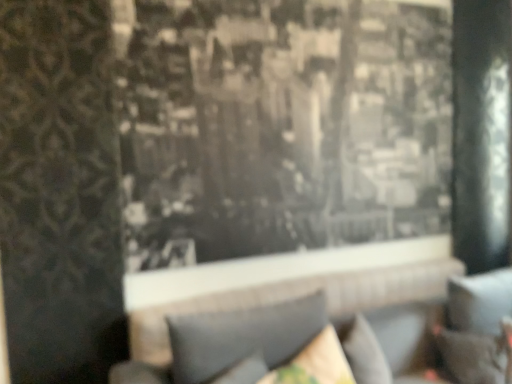
You are a GUI agent. You are given a task and a screenshot of the screen. Output one action in this format:
    pyautogui.click(x=<x>, y=<y>)
    Task: Click on the velvet beige pillow at lower center, the second pillow in the right-to-left sequence
    The height and width of the screenshot is (384, 512).
    Given the screenshot: What is the action you would take?
    pyautogui.click(x=315, y=363)

In order to face textured gray pillow at lower center, which is the 1th pillow from left to right, should I rotate leftwards or rightwards?

Turn right by 0.058 degrees to look at textured gray pillow at lower center, which is the 1th pillow from left to right.

The width and height of the screenshot is (512, 384). I want to click on gray fabric couch at center, so click(234, 338).

Is velvet beige pillow at lower center, arranged as the 2th pillow when viewed from the left, oriented towards textured gray pillow at lower center, placed as the 3th pillow when sorted from right to left?

Yes.

Are velvet beige pillow at lower center, the second pillow in the right-to-left sequence, and textured gray pillow at lower center, placed as the 3th pillow when sorted from right to left, beside each other?

No, velvet beige pillow at lower center, the second pillow in the right-to-left sequence, is not touching textured gray pillow at lower center, placed as the 3th pillow when sorted from right to left.

What's the angular difference between velvet beige pillow at lower center, arranged as the 2th pillow when viewed from the left, and textured gray pillow at lower center, which is the 1th pillow from left to right,'s facing directions?

There is a 0.000548-degree angle between the facing directions of velvet beige pillow at lower center, arranged as the 2th pillow when viewed from the left, and textured gray pillow at lower center, which is the 1th pillow from left to right.

Who is taller, velvet beige pillow at lower center, the second pillow in the right-to-left sequence, or black textured fabric at center?

black textured fabric at center is taller.

Is velvet beige pillow at lower center, arranged as the 2th pillow when viewed from the left, facing away from black textured fabric at center?

velvet beige pillow at lower center, arranged as the 2th pillow when viewed from the left, is not turned away from black textured fabric at center.

Is velvet beige pillow at lower center, arranged as the 2th pillow when viewed from the left, positioned behind black textured fabric at center?

No, it is in front of black textured fabric at center.

From a real-world perspective, is velvet beige pillow at lower center, arranged as the 2th pillow when viewed from the left, positioned above or below black textured fabric at center?

From a real-world perspective, velvet beige pillow at lower center, arranged as the 2th pillow when viewed from the left, is physically below black textured fabric at center.

How much distance is there between textured gray pillow at lower center, which is the 1th pillow from left to right, and black textured fabric at center?

textured gray pillow at lower center, which is the 1th pillow from left to right, is 33.33 inches away from black textured fabric at center.

Is textured gray pillow at lower center, which is the 1th pillow from left to right, positioned with its back to black textured fabric at center?

No, textured gray pillow at lower center, which is the 1th pillow from left to right,'s orientation is not away from black textured fabric at center.

Considering the relative sizes of textured gray pillow at lower center, placed as the 3th pillow when sorted from right to left, and black textured fabric at center in the image provided, is textured gray pillow at lower center, placed as the 3th pillow when sorted from right to left, smaller than black textured fabric at center?

Correct, textured gray pillow at lower center, placed as the 3th pillow when sorted from right to left, occupies less space than black textured fabric at center.

From a real-world perspective, is textured gray pillow at lower center, which is the 1th pillow from left to right, over black textured fabric at center?

No.

From a real-world perspective, does velvet beige pillow at lower center, the second pillow in the right-to-left sequence, sit lower than gray fabric couch at center?

Actually, velvet beige pillow at lower center, the second pillow in the right-to-left sequence, is physically above gray fabric couch at center in the real world.

Does velvet beige pillow at lower center, the second pillow in the right-to-left sequence, come behind gray fabric couch at center?

Yes.

From the image's perspective, who appears lower, velvet beige pillow at lower center, the second pillow in the right-to-left sequence, or gray fabric couch at center?

gray fabric couch at center, from the image's perspective.

Between velvet beige pillow at lower center, the second pillow in the right-to-left sequence, and gray fabric couch at center, which one has larger size?

gray fabric couch at center.

Where is `window that appears behind the gray fabric couch at center`? window that appears behind the gray fabric couch at center is located at coordinates (281, 139).

In the scene shown: Looking at their sizes, would you say black textured fabric at center is wider or thinner than gray fabric couch at center?

Considering their sizes, black textured fabric at center looks slimmer than gray fabric couch at center.

From a real-world perspective, is black textured fabric at center above or below gray fabric couch at center?

black textured fabric at center is situated higher than gray fabric couch at center in the real world.

Is black textured fabric at center spatially inside gray fabric couch at center, or outside of it?

black textured fabric at center cannot be found inside gray fabric couch at center.

In the scene shown: Is velvet dark brown pillow at lower right, the third pillow positioned from the left, far from textured gray pillow at lower center, placed as the 3th pillow when sorted from right to left?

velvet dark brown pillow at lower right, the third pillow positioned from the left, is near textured gray pillow at lower center, placed as the 3th pillow when sorted from right to left, not far away.

From the image's perspective, is velvet dark brown pillow at lower right, which ranks as the first pillow in right-to-left order, on top of textured gray pillow at lower center, placed as the 3th pillow when sorted from right to left?

No, from the image's perspective, velvet dark brown pillow at lower right, which ranks as the first pillow in right-to-left order, is not on top of textured gray pillow at lower center, placed as the 3th pillow when sorted from right to left.

Can we say velvet dark brown pillow at lower right, the third pillow positioned from the left, lies outside textured gray pillow at lower center, which is the 1th pillow from left to right?

Yes, velvet dark brown pillow at lower right, the third pillow positioned from the left, is not within textured gray pillow at lower center, which is the 1th pillow from left to right.

Which of these two, black textured fabric at center or velvet beige pillow at lower center, arranged as the 2th pillow when viewed from the left, is bigger?

black textured fabric at center.

Can velvet beige pillow at lower center, the second pillow in the right-to-left sequence, be found inside black textured fabric at center?

That's incorrect, velvet beige pillow at lower center, the second pillow in the right-to-left sequence, is not inside black textured fabric at center.

Can you tell me how much black textured fabric at center and velvet beige pillow at lower center, the second pillow in the right-to-left sequence, differ in facing direction?

They differ by 0.816 degrees in their facing directions.

From the image's perspective, count 1st pillows downward from the textured gray pillow at lower center, placed as the 3th pillow when sorted from right to left, and point to it. Please provide its 2D coordinates.

[(315, 363)]

Locate an element on the screen. Image resolution: width=512 pixels, height=384 pixels. window located above the velvet beige pillow at lower center, arranged as the 2th pillow when viewed from the left (from a real-world perspective) is located at coordinates (281, 139).

Which object lies nearer to the anchor point black textured fabric at center, velvet beige pillow at lower center, arranged as the 2th pillow when viewed from the left, or velvet dark brown pillow at lower right, the third pillow positioned from the left?

velvet beige pillow at lower center, arranged as the 2th pillow when viewed from the left, is positioned closer to the anchor black textured fabric at center.

Estimate the real-world distances between objects in this image. Which object is further from velvet dark brown pillow at lower right, the third pillow positioned from the left, black textured fabric at center or velvet beige pillow at lower center, arranged as the 2th pillow when viewed from the left?

black textured fabric at center is positioned further to the anchor velvet dark brown pillow at lower right, the third pillow positioned from the left.

Which object lies nearer to the anchor point gray fabric couch at center, black textured fabric at center or velvet beige pillow at lower center, the second pillow in the right-to-left sequence?

velvet beige pillow at lower center, the second pillow in the right-to-left sequence, is closer to gray fabric couch at center.

Which object lies nearer to the anchor point velvet beige pillow at lower center, the second pillow in the right-to-left sequence, gray fabric couch at center or textured gray pillow at lower center, which is the 1th pillow from left to right?

textured gray pillow at lower center, which is the 1th pillow from left to right, lies closer to velvet beige pillow at lower center, the second pillow in the right-to-left sequence, than the other object.

Estimate the real-world distances between objects in this image. Which object is further from velvet beige pillow at lower center, the second pillow in the right-to-left sequence, black textured fabric at center or textured gray pillow at lower center, which is the 1th pillow from left to right?

black textured fabric at center.

When comparing their distances from textured gray pillow at lower center, which is the 1th pillow from left to right, does black textured fabric at center or gray fabric couch at center seem further?

black textured fabric at center.

From the image, which object appears to be nearer to black textured fabric at center, gray fabric couch at center or textured gray pillow at lower center, placed as the 3th pillow when sorted from right to left?

gray fabric couch at center.

Consider the image. From the image, which object appears to be nearer to gray fabric couch at center, velvet beige pillow at lower center, arranged as the 2th pillow when viewed from the left, or textured gray pillow at lower center, which is the 1th pillow from left to right?

Based on the image, textured gray pillow at lower center, which is the 1th pillow from left to right, appears to be nearer to gray fabric couch at center.

You are a GUI agent. You are given a task and a screenshot of the screen. Output one action in this format:
    pyautogui.click(x=<x>, y=<y>)
    Task: Click on the pillow situated between textured gray pillow at lower center, which is the 1th pillow from left to right, and gray fabric couch at center from left to right
    This screenshot has width=512, height=384.
    Given the screenshot: What is the action you would take?
    point(315,363)

The width and height of the screenshot is (512, 384). Identify the location of couch between textured gray pillow at lower center, placed as the 3th pillow when sorted from right to left, and velvet dark brown pillow at lower right, which ranks as the first pillow in right-to-left order, from left to right. (234, 338).

You are a GUI agent. You are given a task and a screenshot of the screen. Output one action in this format:
    pyautogui.click(x=<x>, y=<y>)
    Task: Click on the pillow between black textured fabric at center and velvet beige pillow at lower center, arranged as the 2th pillow when viewed from the left, vertically
    Image resolution: width=512 pixels, height=384 pixels.
    Given the screenshot: What is the action you would take?
    pyautogui.click(x=242, y=336)

You are a GUI agent. You are given a task and a screenshot of the screen. Output one action in this format:
    pyautogui.click(x=<x>, y=<y>)
    Task: Click on the pillow between textured gray pillow at lower center, which is the 1th pillow from left to right, and velvet dark brown pillow at lower right, the third pillow positioned from the left, from left to right
    This screenshot has height=384, width=512.
    Given the screenshot: What is the action you would take?
    pyautogui.click(x=315, y=363)